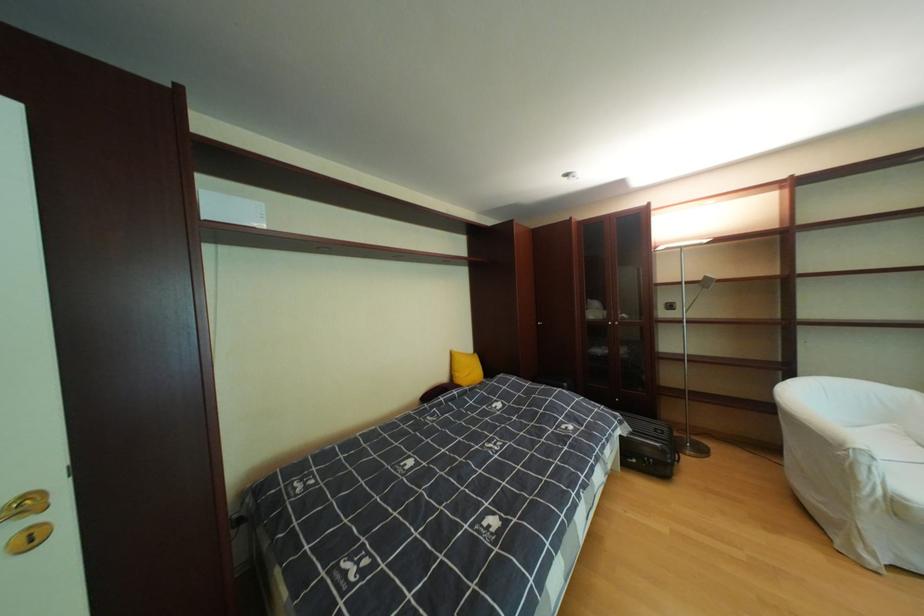
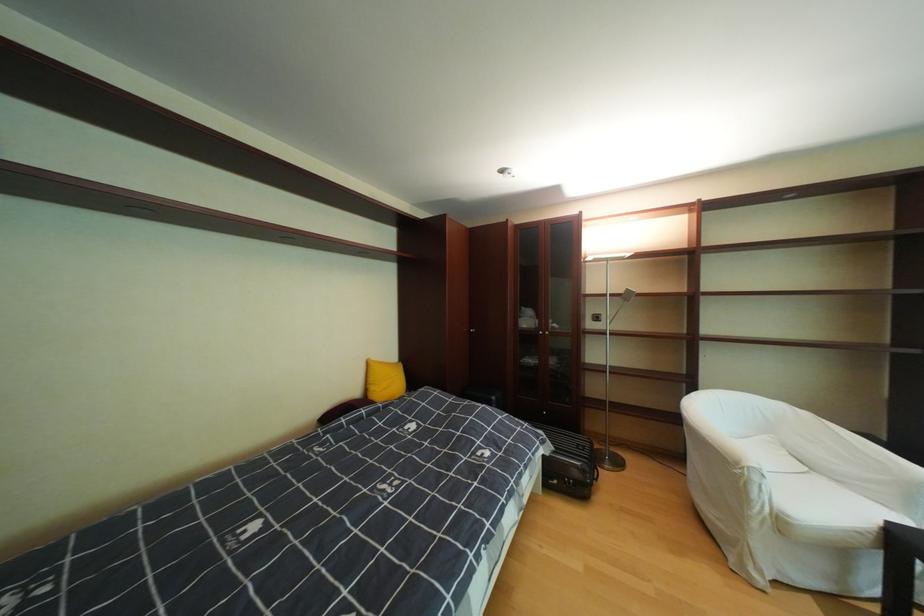
Find the pixel in the second image that matches point 661,461 in the first image.

(580, 483)